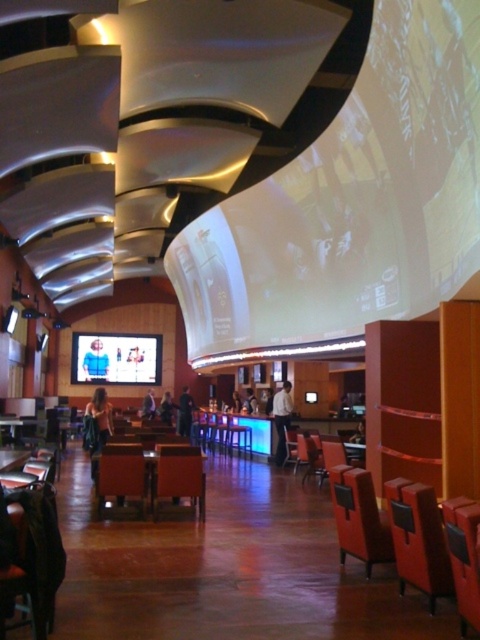
Question: Which point is closer to the camera taking this photo?

Choices:
 (A) (290, 416)
 (B) (182, 456)
 (C) (151, 416)

Answer: (B)

Question: Does black fabric person at center have a smaller size compared to dark gray suit at center?

Choices:
 (A) no
 (B) yes

Answer: (B)

Question: Among these objects, which one is nearest to the camera?

Choices:
 (A) blue denim shirt at center
 (B) white shirt at center

Answer: (B)

Question: Can you confirm if dark brown leather jacket at lower left is wider than dark blue shirt at center?

Choices:
 (A) no
 (B) yes

Answer: (B)

Question: Does white shirt at center appear on the left side of smooth leather jacket at center?

Choices:
 (A) yes
 (B) no

Answer: (B)

Question: Which of these objects is positioned closest to the white shirt at center?

Choices:
 (A) dark brown leather jacket at lower left
 (B) blue denim shirt at center
 (C) matte brown armchair at center
 (D) dark brown leather jacket at bar

Answer: (D)